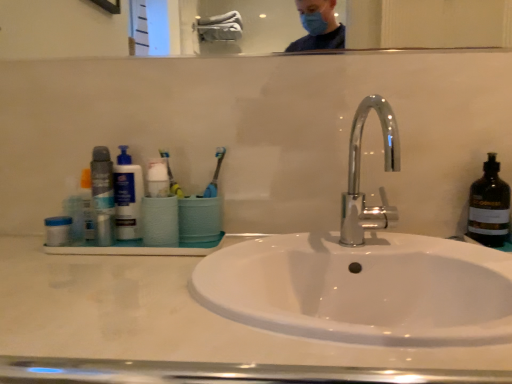
Question: Does matte plastic bottle at left appear on the left side of yellow rubber toothbrush at center?

Choices:
 (A) yes
 (B) no

Answer: (A)

Question: Is matte plastic bottle at left positioned before yellow rubber toothbrush at center?

Choices:
 (A) no
 (B) yes

Answer: (A)

Question: Can you confirm if matte plastic bottle at left is taller than yellow rubber toothbrush at center?

Choices:
 (A) no
 (B) yes

Answer: (B)

Question: Are matte plastic bottle at left and yellow rubber toothbrush at center located far from each other?

Choices:
 (A) yes
 (B) no

Answer: (B)

Question: Is matte plastic bottle at left oriented towards yellow rubber toothbrush at center?

Choices:
 (A) no
 (B) yes

Answer: (A)

Question: Considering the positions of yellow rubber toothbrush at center and chrome/metallic faucet at center in the image, is yellow rubber toothbrush at center taller or shorter than chrome/metallic faucet at center?

Choices:
 (A) short
 (B) tall

Answer: (A)

Question: Relative to chrome/metallic faucet at center, is yellow rubber toothbrush at center in front or behind?

Choices:
 (A) front
 (B) behind

Answer: (B)

Question: Is point (165, 163) closer or farther from the camera than point (350, 140)?

Choices:
 (A) farther
 (B) closer

Answer: (B)

Question: Would you say yellow rubber toothbrush at center is inside or outside chrome/metallic faucet at center?

Choices:
 (A) inside
 (B) outside

Answer: (B)

Question: Is matte black deodorant at left situated inside white glossy sink at center or outside?

Choices:
 (A) outside
 (B) inside

Answer: (A)

Question: Considering the positions of point (97, 213) and point (109, 278), is point (97, 213) closer or farther from the camera than point (109, 278)?

Choices:
 (A) closer
 (B) farther

Answer: (B)

Question: In terms of width, does matte black deodorant at left look wider or thinner when compared to white glossy sink at center?

Choices:
 (A) wide
 (B) thin

Answer: (B)

Question: Is matte black deodorant at left bigger or smaller than white glossy sink at center?

Choices:
 (A) small
 (B) big

Answer: (A)

Question: From the image's perspective, is white glossy sink at center above or below matte black deodorant at left?

Choices:
 (A) below
 (B) above

Answer: (A)

Question: Is white glossy sink at center in front of or behind matte black deodorant at left in the image?

Choices:
 (A) front
 (B) behind

Answer: (A)